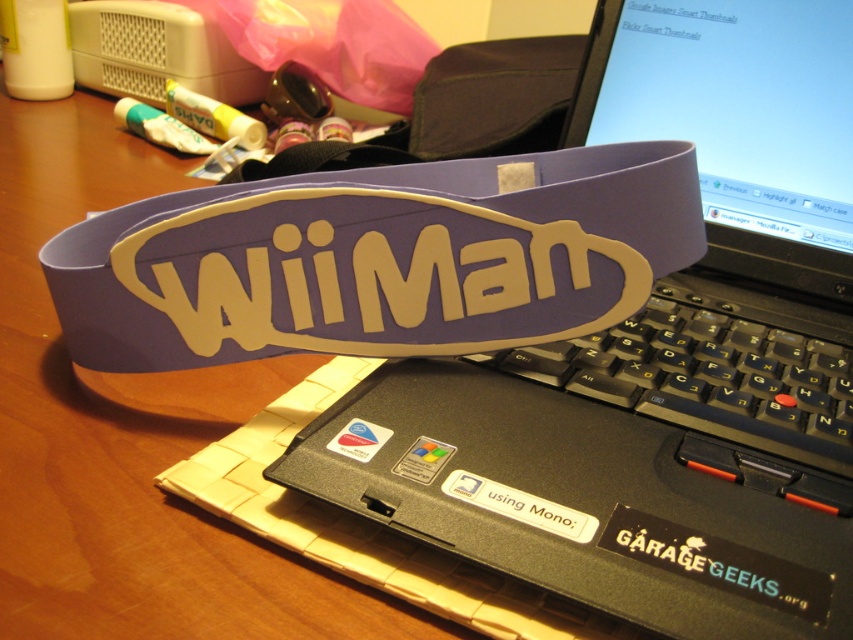
You are setting up your desk and need to place both the black plastic laptop at center and the black plastic keyboard at center. If you want to place them side by side horizontally, which one should you position first to the left to ensure they fit within the desk space?

The black plastic laptop at center is larger in size than the black plastic keyboard at center, so you should position the black plastic keyboard at center first to the left to ensure they fit within the desk space.

Looking at this image, you are setting up a new desk and need to place the black plastic laptop at center and the black plastic keyboard at center. Based on the scene, which object is closer to you when you are sitting at the desk?

The black plastic laptop at center is closer to you because it is in front of the black plastic keyboard at center.

Looking at this image, you are organizing your desk and need to place a new item between the black plastic laptop at center and the black plastic keyboard at center. Is there vertical space between them to fit a 2cm thick notebook?

The black plastic laptop at center is above the black plastic keyboard at center, so there is vertical space between them. A 2cm thick notebook can be placed in between.